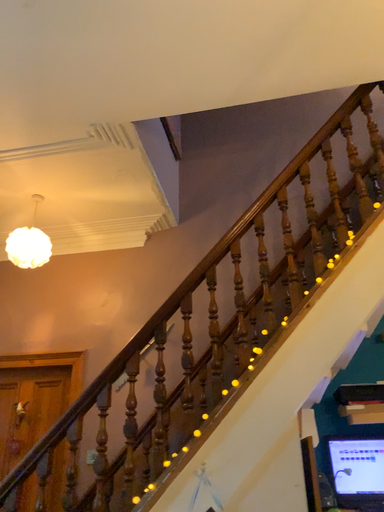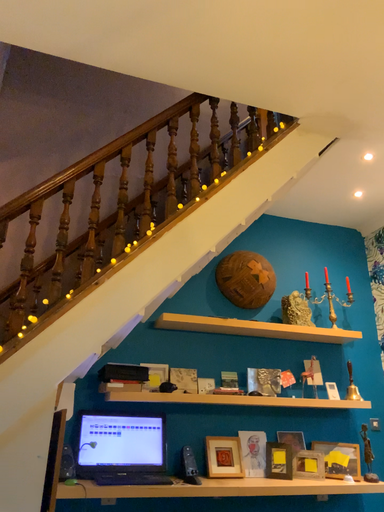
Question: How did the camera likely rotate when shooting the video?

Choices:
 (A) rotated downward
 (B) rotated upward

Answer: (A)